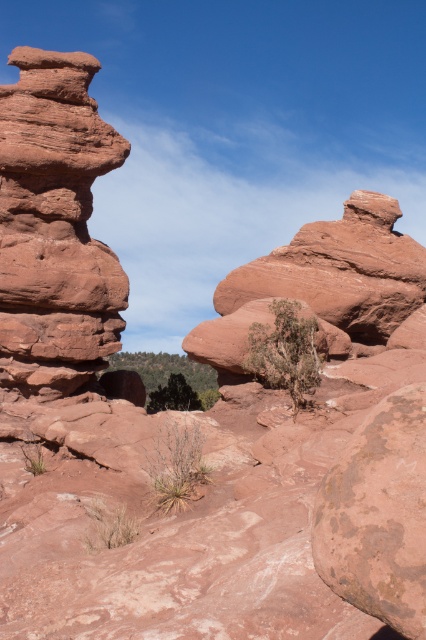
Does rustic sandstone rock at center have a larger size compared to rusty stone boulder at center?

Yes.

Who is higher up, rustic sandstone rock at center or rusty stone boulder at center?

rustic sandstone rock at center is above.

Who is more distant from viewer, (365, 326) or (388, 541)?

Positioned behind is point (365, 326).

This screenshot has width=426, height=640. Identify the location of rustic sandstone rock at center. (321, 284).